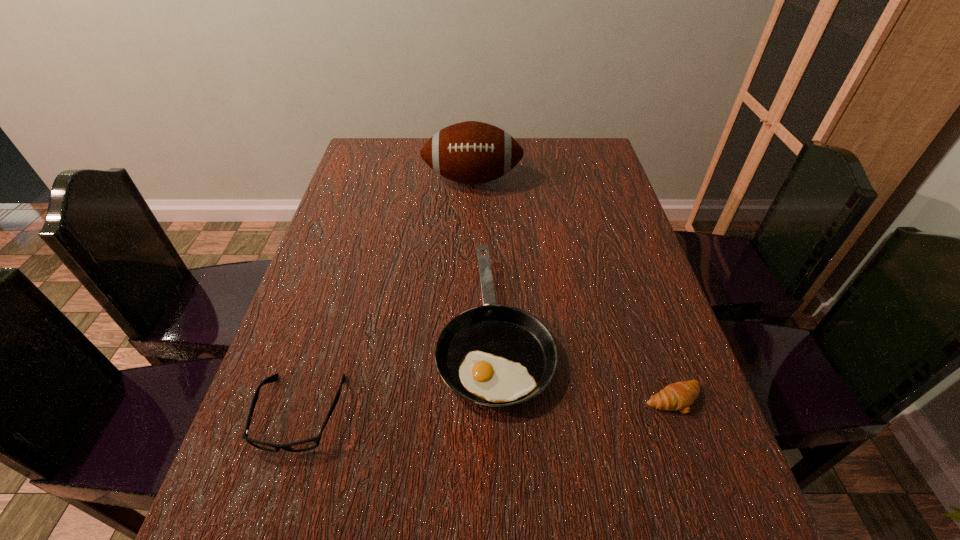
Where is `vacant space located 0.180m on the front of the shortest object`? vacant space located 0.180m on the front of the shortest object is located at coordinates (716, 524).

At what (x,y) coordinates should I click in order to perform the action: click on object at the far edge. Please return your answer as a coordinate pair (x, y). This screenshot has height=540, width=960. Looking at the image, I should click on (471, 152).

Identify the location of object at the left edge. (300, 446).

Where is `object located at the right edge`? object located at the right edge is located at coordinates (677, 396).

The height and width of the screenshot is (540, 960). Identify the location of vacant space at the far edge of the desktop. (541, 140).

At what (x,y) coordinates should I click in order to perform the action: click on blank space at the left edge of the desktop. Please return your answer as a coordinate pair (x, y). Image resolution: width=960 pixels, height=540 pixels. Looking at the image, I should click on (342, 377).

This screenshot has height=540, width=960. What are the coordinates of `vacant area at the right edge` in the screenshot? It's located at (672, 340).

This screenshot has height=540, width=960. What are the coordinates of `vacant region at the far left corner of the desktop` in the screenshot? It's located at (379, 140).

You are a GUI agent. You are given a task and a screenshot of the screen. Output one action in this format:
    pyautogui.click(x=<x>, y=<y>)
    Task: Click on the free spot between the football and the frying pan
    
    Given the screenshot: What is the action you would take?
    pyautogui.click(x=484, y=253)

Find the location of `free space that is in between the second shortest object and the rightmost object`. free space that is in between the second shortest object and the rightmost object is located at coordinates coord(487,407).